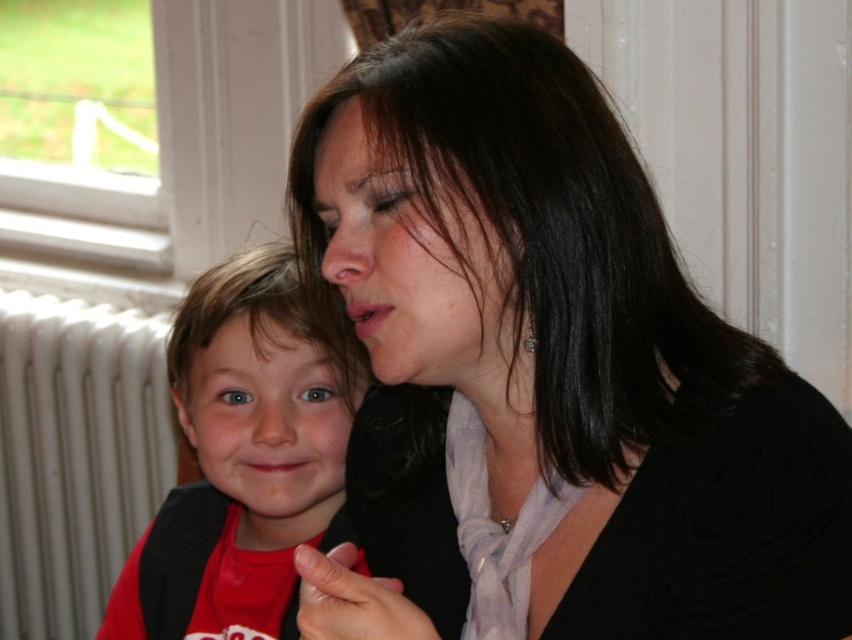
You are a photographer setting up a shoot in this indoor scene. You need to place a 12 inch wide decorative plate between the black matte scarf at center and the white metallic radiator at left. Can the plate fit between them without overlapping either object?

The black matte scarf at center is narrower than the white metallic radiator at left. However, the exact distance between them isn not specified. Since the scarf is at center and the radiator is at left, there might be enough space. But because the scarf is narrower, it doesn not guarantee the 12 inch plate will fit. More information about their separation is needed to determine this.

You are a photographer adjusting your camera settings. You notice the black matte scarf at center and the red shirt at center in your viewfinder. Which object should you focus on to ensure the closest item is in sharp focus?

The black matte scarf at center is closer to the viewer than the red shirt at center, so you should focus on the black matte scarf at center to ensure the closest item is in sharp focus.

You are a photographer trying to adjust the lighting for a portrait. You notice the black matte scarf at center and the red shirt at center. Which object is positioned to the right side of the other?

The black matte scarf at center is to the right of the red shirt at center.